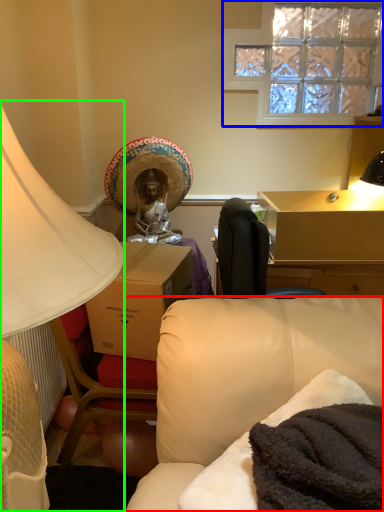
Question: Estimate the real-world distances between objects in this image. Which object is closer to studio couch (highlighted by a red box), window (highlighted by a blue box) or lamp (highlighted by a green box)?

Choices:
 (A) window
 (B) lamp

Answer: (B)